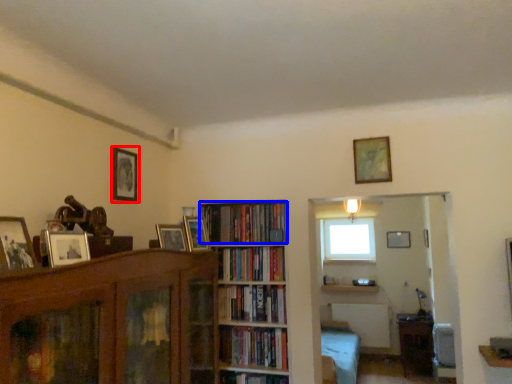
Question: Among these objects, which one is nearest to the camera, picture frame (highlighted by a red box) or book (highlighted by a blue box)?

Choices:
 (A) picture frame
 (B) book

Answer: (A)